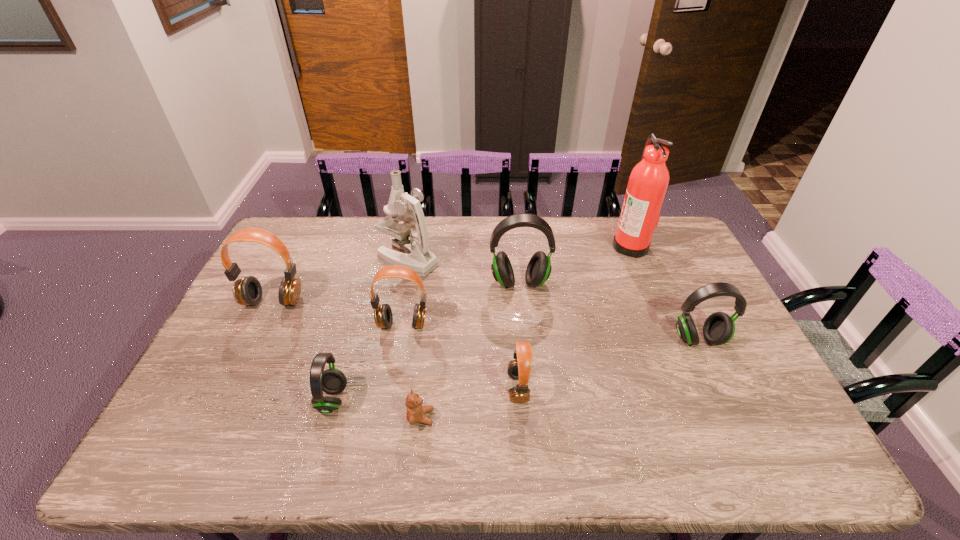
Locate an element on the screen. The width and height of the screenshot is (960, 540). the third headset from left to right is located at coordinates (x=383, y=316).

At what (x,y) coordinates should I click in order to perform the action: click on the smallest brown headset. Please return your answer as a coordinate pair (x, y). This screenshot has height=540, width=960. Looking at the image, I should click on (519, 369).

At what (x,y) coordinates should I click in order to perform the action: click on the nearest brown headset. Please return your answer as a coordinate pair (x, y). The image size is (960, 540). Looking at the image, I should click on (519, 369).

Identify the location of the second headset from left to right. click(x=332, y=381).

Where is `the leftmost black headset`? the leftmost black headset is located at coordinates (332, 381).

I want to click on the shortest object, so (415, 412).

In order to click on brown teddy bear in this screenshot , I will do [415, 412].

In order to click on vacant space located on the label side of the tallest object in this screenshot , I will do `click(513, 245)`.

At what (x,y) coordinates should I click in order to perform the action: click on free point located on the label side of the tallest object. Please return your answer as a coordinate pair (x, y). This screenshot has height=540, width=960. Looking at the image, I should click on pos(585,245).

At what (x,y) coordinates should I click in order to perform the action: click on vacant area located 0.360m on the label side of the tallest object. Please return your answer as a coordinate pair (x, y). The height and width of the screenshot is (540, 960). Looking at the image, I should click on coord(513,245).